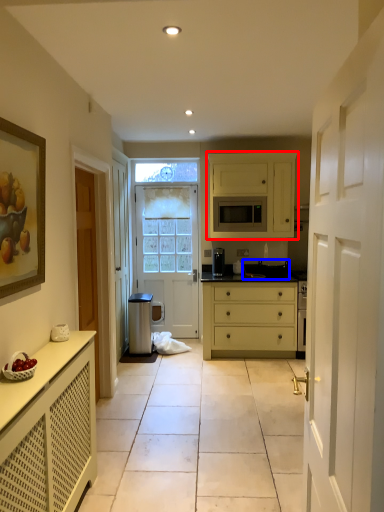
Question: Which object appears farthest to the camera in this image, cabinetry (highlighted by a red box) or appliance (highlighted by a blue box)?

Choices:
 (A) cabinetry
 (B) appliance

Answer: (B)